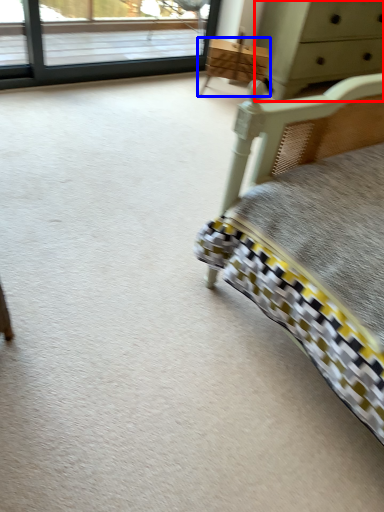
Question: Which point is further to the camera, chest of drawers (highlighted by a red box) or furniture (highlighted by a blue box)?

Choices:
 (A) chest of drawers
 (B) furniture

Answer: (B)